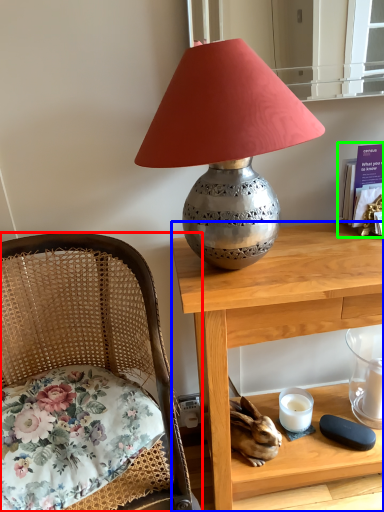
Question: Based on their relative distances, which object is nearer to chair (highlighted by a red box)? Choose from desk (highlighted by a blue box) and book (highlighted by a green box).

Choices:
 (A) desk
 (B) book

Answer: (A)